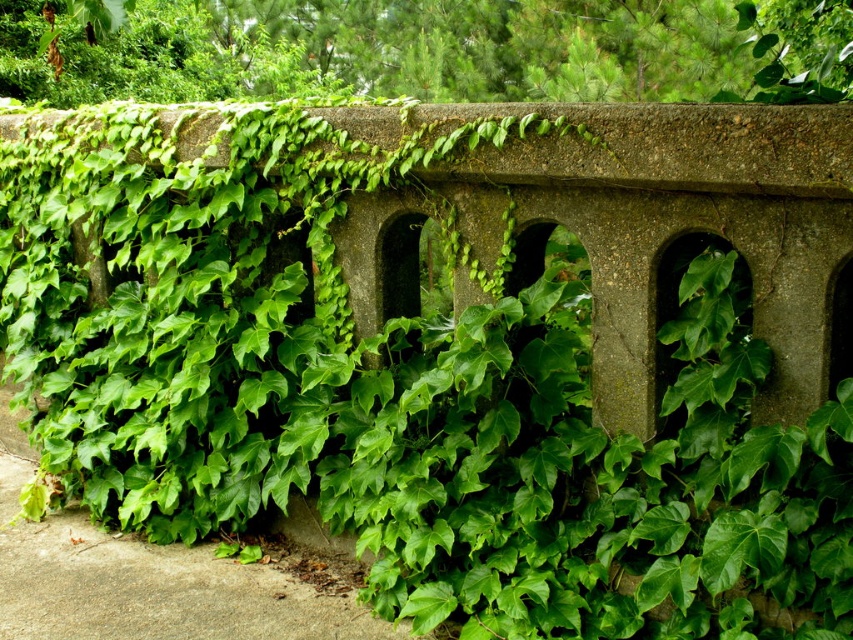
Question: Where is green leafy ivy at upper center located in relation to green leafy ivy at lower left in the image?

Choices:
 (A) right
 (B) left

Answer: (A)

Question: Among these objects, which one is nearest to the camera?

Choices:
 (A) green leafy ivy at lower left
 (B) green leafy ivy at upper center

Answer: (A)

Question: Does green leafy ivy at upper center have a lesser width compared to green leafy ivy at lower left?

Choices:
 (A) no
 (B) yes

Answer: (B)

Question: Among these points, which one is nearest to the camera?

Choices:
 (A) (351, 45)
 (B) (10, 483)

Answer: (B)

Question: Is green leafy ivy at upper center to the left of green leafy ivy at lower left from the viewer's perspective?

Choices:
 (A) no
 (B) yes

Answer: (A)